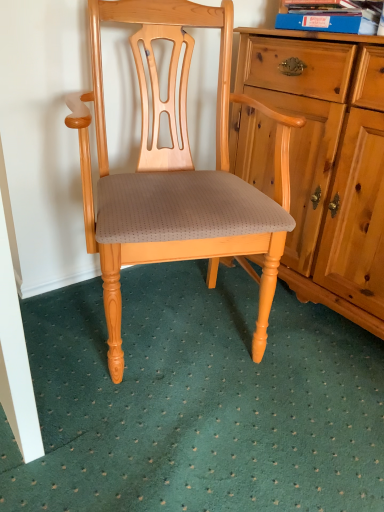
Question: From the image's perspective, is green textured carpet at lower center above or below matte wood chair at center?

Choices:
 (A) above
 (B) below

Answer: (B)

Question: Looking at their shapes, would you say green textured carpet at lower center is wider or thinner than matte wood chair at center?

Choices:
 (A) thin
 (B) wide

Answer: (B)

Question: Which of these objects is positioned farthest from the green textured carpet at lower center?

Choices:
 (A) matte wood chair at center
 (B) blue cardboard book at upper right

Answer: (B)

Question: Which of these objects is positioned closest to the matte wood chair at center?

Choices:
 (A) green textured carpet at lower center
 (B) blue cardboard book at upper right

Answer: (A)